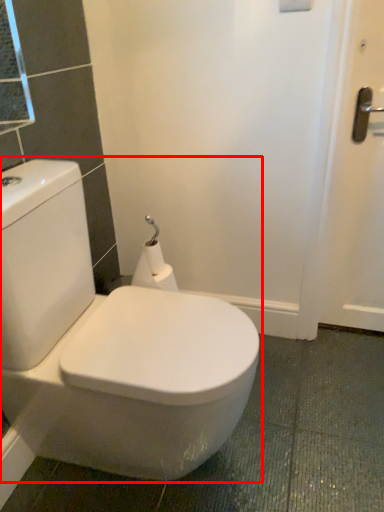
Question: Where is toilet (annotated by the red box) located in relation to toilet paper in the image?

Choices:
 (A) left
 (B) right

Answer: (A)